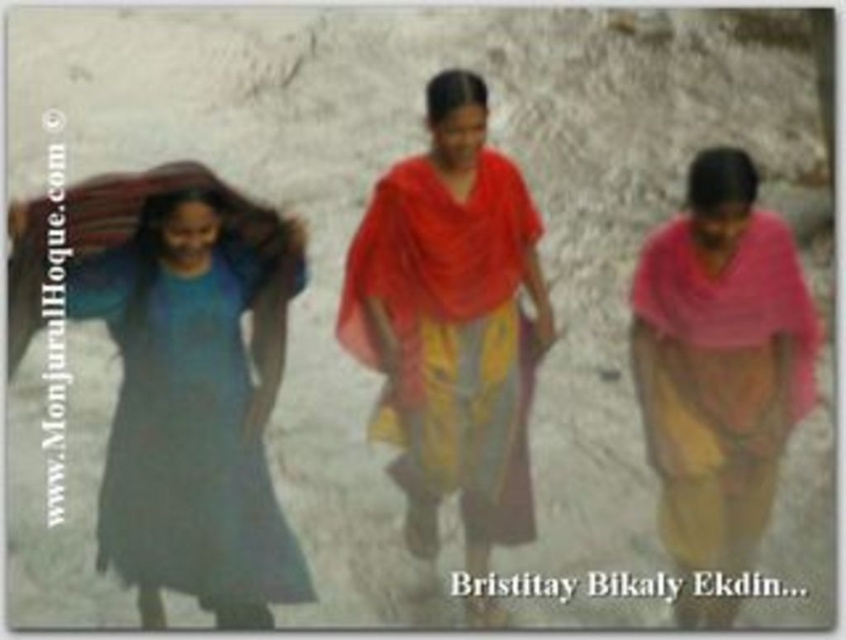
Question: Does pink fabric shawl at center lie behind red fabric shawl at center?

Choices:
 (A) yes
 (B) no

Answer: (B)

Question: Which of the following is the farthest from the observer?

Choices:
 (A) (731, 460)
 (B) (389, 372)

Answer: (B)

Question: Which point is closer to the camera taking this photo?

Choices:
 (A) (239, 468)
 (B) (394, 244)
 (C) (723, 147)
 (D) (354, 289)

Answer: (A)

Question: Is matte blue dress at left wider than red fabric shawl at center?

Choices:
 (A) no
 (B) yes

Answer: (B)

Question: Estimate the real-world distances between objects in this image. Which object is farther from the matte blue dress at left?

Choices:
 (A) pink fabric shawl at center
 (B) red fabric shawl at center

Answer: (A)

Question: Can you confirm if pink fabric shawl at center is smaller than matte blue dress at left?

Choices:
 (A) yes
 (B) no

Answer: (B)